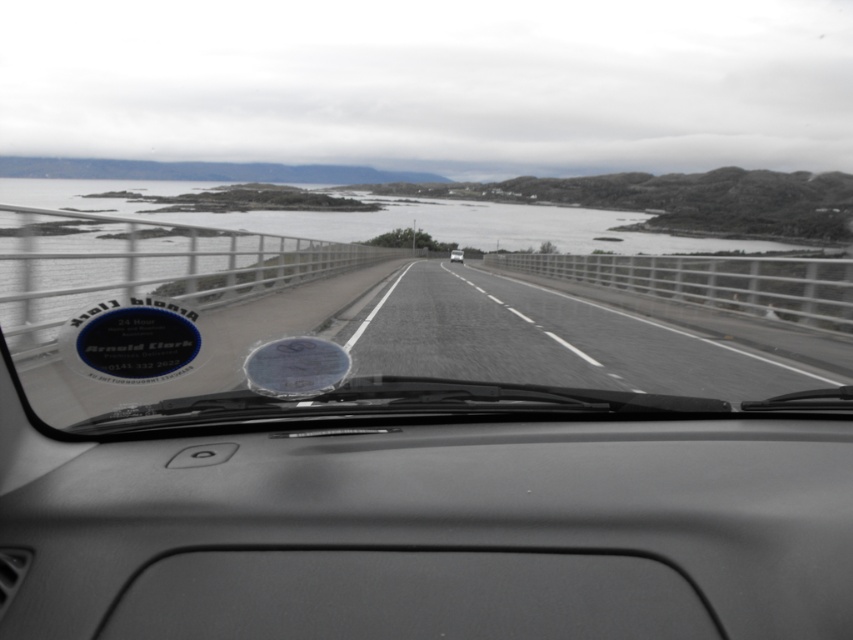
You are a passenger in the vehicle and want to know which of the two points, point (700,582) or point (28,193), is nearer to you. Based on the scene, can you determine which point is closer?

Point (700,582) is closer to the camera than point (28,193), so the passenger would perceive point (700,582) as nearer.

You are driving a car and want to overtake the white glossy car at center. The transparent glass windshield at center is in your path. Can you safely move around it?

The transparent glass windshield at center is positioned on the left side of white glossy car at center, so you cannot safely move around it since the windshield is part of your own vehicle and obstructing the path.

You are a passenger in the car and want to check the speedometer on the matte gray dashboard at center. Since you are facing forward, can you see the speedometer through the transparent glass windshield at center?

The matte gray dashboard at center is positioned under the transparent glass windshield at center, so you can see the speedometer through the transparent glass windshield at center because the dashboard is below the windshield.